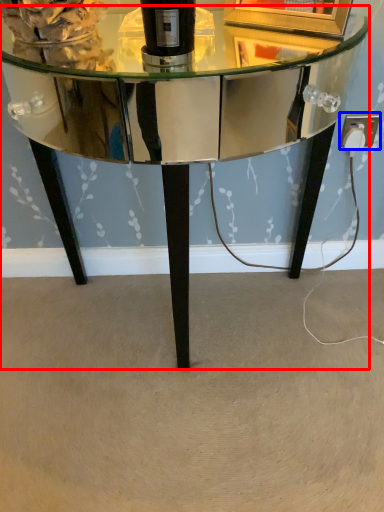
Question: Which object is closer to the camera taking this photo, table (highlighted by a red box) or electric outlet (highlighted by a blue box)?

Choices:
 (A) table
 (B) electric outlet

Answer: (A)